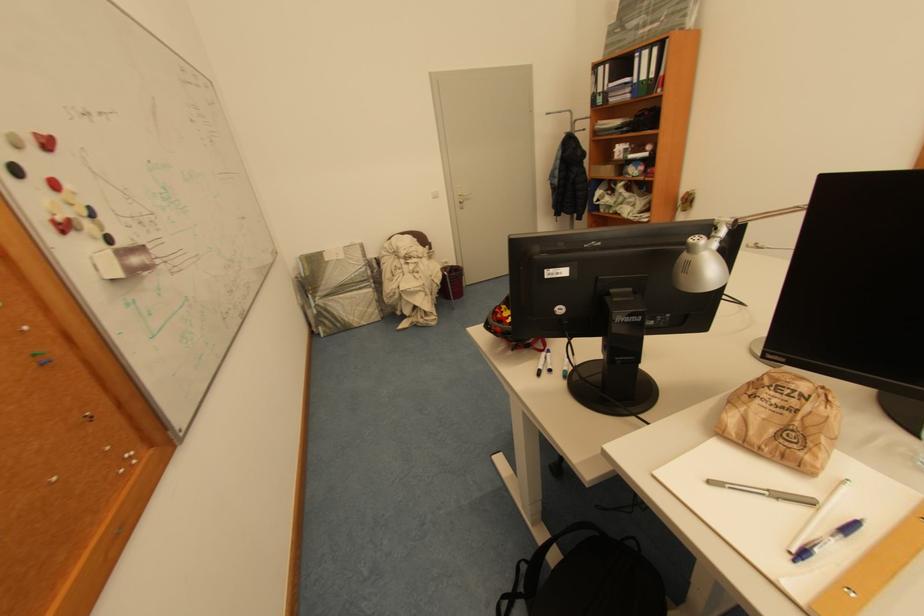
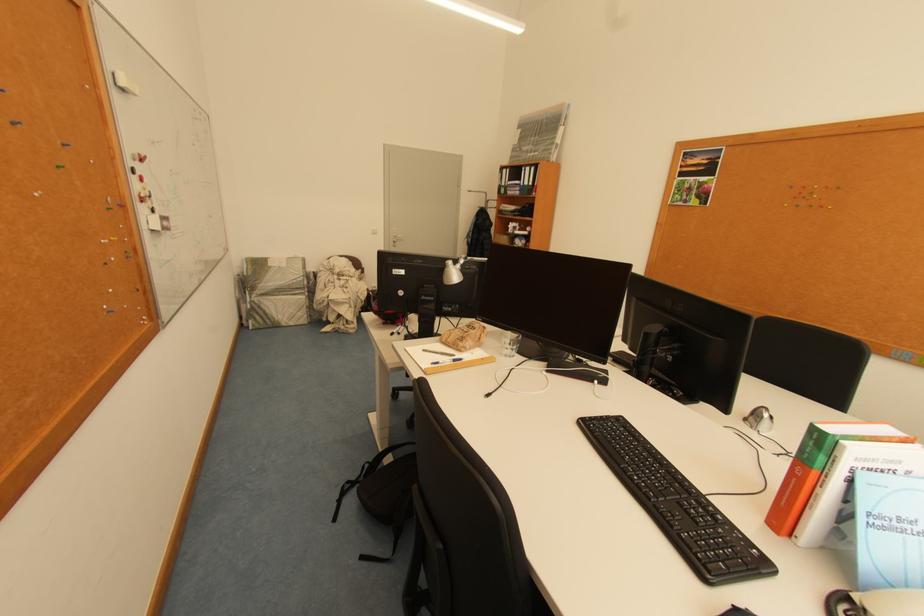
Find the pixel in the second image that matches the point at 67,220 in the first image.

(151, 197)